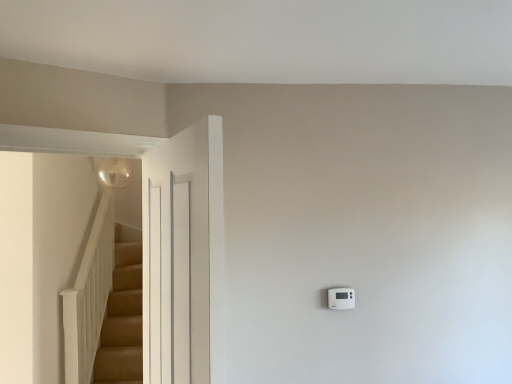
Question: Does white plastic thermostat at right have a lesser height compared to white painted wood door at left?

Choices:
 (A) yes
 (B) no

Answer: (A)

Question: Does white plastic thermostat at right come behind white painted wood door at left?

Choices:
 (A) no
 (B) yes

Answer: (B)

Question: Is the surface of white plastic thermostat at right in direct contact with white painted wood door at left?

Choices:
 (A) yes
 (B) no

Answer: (B)

Question: Is white plastic thermostat at right bigger than white painted wood door at left?

Choices:
 (A) yes
 (B) no

Answer: (B)

Question: From the image's perspective, is white plastic thermostat at right above white painted wood door at left?

Choices:
 (A) no
 (B) yes

Answer: (A)

Question: From a real-world perspective, does white plastic thermostat at right stand above white painted wood door at left?

Choices:
 (A) no
 (B) yes

Answer: (A)

Question: From the image's perspective, is white painted wood door at left on top of white plastic thermostat at right?

Choices:
 (A) yes
 (B) no

Answer: (A)

Question: Can you confirm if white painted wood door at left is wider than white plastic thermostat at right?

Choices:
 (A) yes
 (B) no

Answer: (A)

Question: Does white painted wood door at left come behind white plastic thermostat at right?

Choices:
 (A) no
 (B) yes

Answer: (A)

Question: Does white painted wood door at left have a greater height compared to white plastic thermostat at right?

Choices:
 (A) yes
 (B) no

Answer: (A)

Question: From the image's perspective, is white painted wood door at left located beneath white plastic thermostat at right?

Choices:
 (A) yes
 (B) no

Answer: (B)

Question: Is white plastic thermostat at right at the back of white painted wood door at left?

Choices:
 (A) yes
 (B) no

Answer: (A)

Question: In the image, is white painted wood door at left positioned in front of or behind white plastic thermostat at right?

Choices:
 (A) behind
 (B) front

Answer: (B)